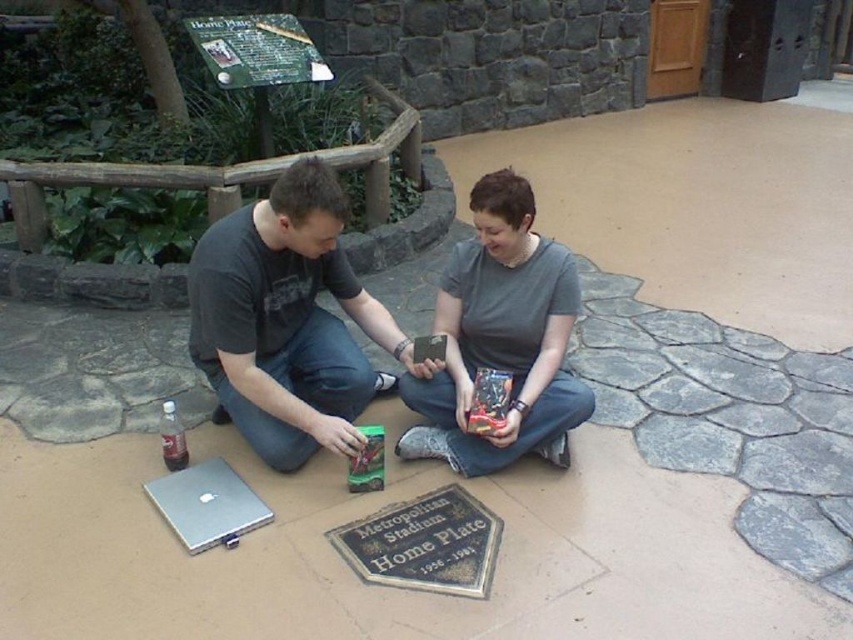
Question: Which object is the farthest from the dark gray matte shirt at center?

Choices:
 (A) silver metallic laptop at lower left
 (B) gray matte shirt at center

Answer: (A)

Question: From the image, what is the correct spatial relationship of dark gray matte shirt at center in relation to gray matte shirt at center?

Choices:
 (A) above
 (B) below

Answer: (A)

Question: Which object is positioned farthest from the silver metallic laptop at lower left?

Choices:
 (A) dark gray matte shirt at center
 (B) gray matte shirt at center

Answer: (B)

Question: Which of the following is the closest to the observer?

Choices:
 (A) (502, 259)
 (B) (239, 532)

Answer: (B)

Question: Can you confirm if dark gray matte shirt at center is positioned to the left of silver metallic laptop at lower left?

Choices:
 (A) yes
 (B) no

Answer: (B)

Question: Can you confirm if dark gray matte shirt at center is thinner than gray matte shirt at center?

Choices:
 (A) yes
 (B) no

Answer: (B)